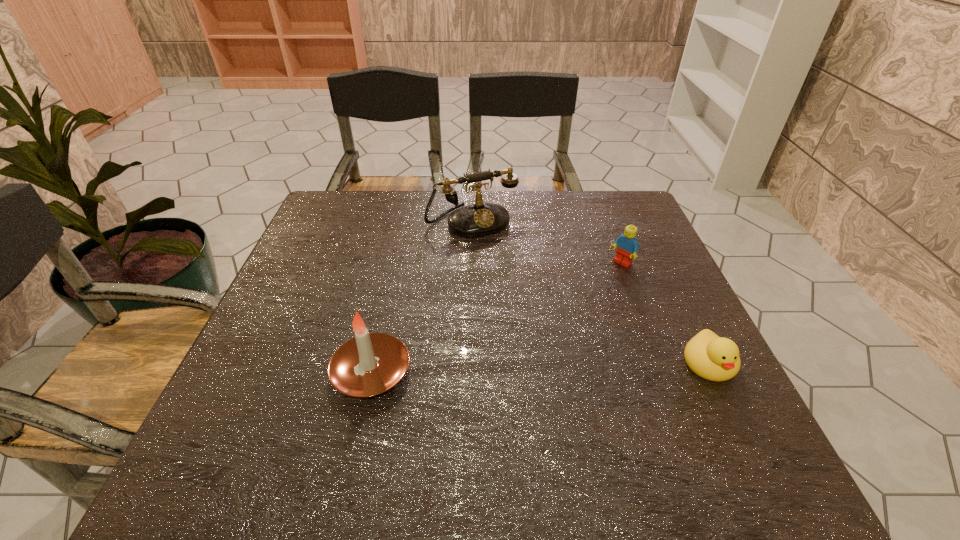
Identify the location of vacant space located 0.300m on the dial of the telephone. The height and width of the screenshot is (540, 960). (536, 311).

The width and height of the screenshot is (960, 540). What are the coordinates of `free space located 0.280m on the dial of the telephone` in the screenshot? It's located at (532, 306).

In order to click on vacant region located on the dial of the telephone in this screenshot , I will do `click(513, 276)`.

This screenshot has height=540, width=960. I want to click on object that is at the far edge, so pos(479,219).

Identify the location of object that is at the near edge. The image size is (960, 540). (369, 364).

Locate an element on the screen. duckling positioned at the right edge is located at coordinates (711, 357).

This screenshot has height=540, width=960. In order to click on Lego that is at the right edge in this screenshot , I will do `click(627, 247)`.

In the image, there is a desktop. Identify the location of vacant space at the far edge. The width and height of the screenshot is (960, 540). (521, 235).

Where is `free space at the left edge of the desktop`? free space at the left edge of the desktop is located at coordinates (309, 238).

Where is `vacant space at the right edge`? This screenshot has height=540, width=960. vacant space at the right edge is located at coordinates (651, 247).